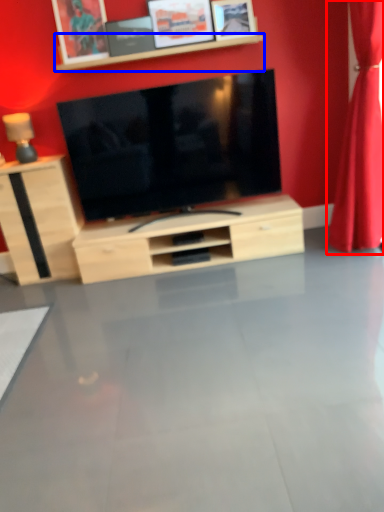
Question: Which point is further to the camera, curtain (highlighted by a red box) or shelf (highlighted by a blue box)?

Choices:
 (A) curtain
 (B) shelf

Answer: (B)